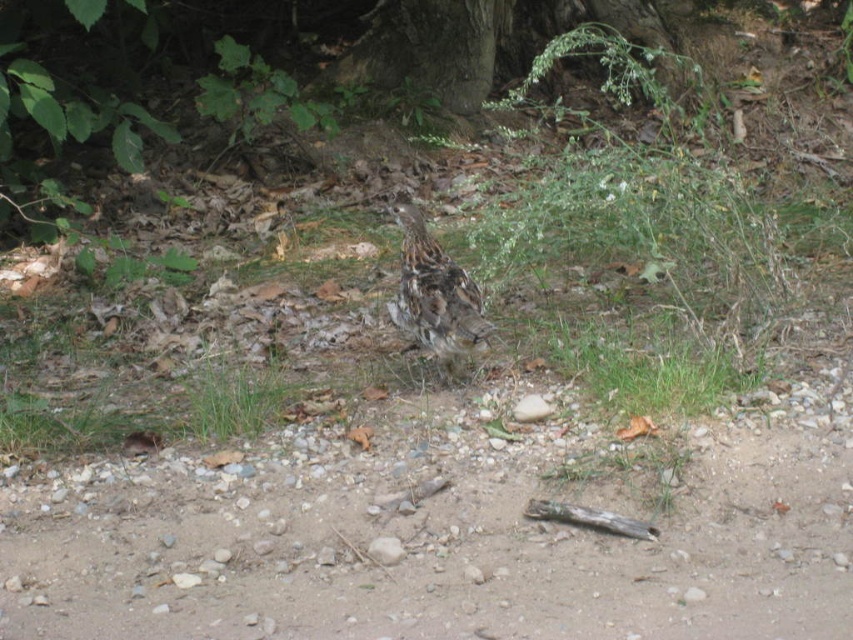
You are a hiker who wants to take a photo of the green soft grass at center and the smooth bark tree at upper center. To ensure both are in frame, should you position yourself to the left or right of the grass?

You should position yourself to the left of the green soft grass at center so that the smooth bark tree at upper center, which is to the right of the grass, can also be captured in the photo.

You are a hiker carrying a backpack with a 3 meter long tent pole. You want to set up camp near the smooth bark tree at upper center. Can you place your tent pole horizontally without it touching the tree?

The smooth bark tree at upper center is 5.72 meters away from the camera. Since the tent pole is only 3 meters long, you can safely place it horizontally near the tree without touching it.